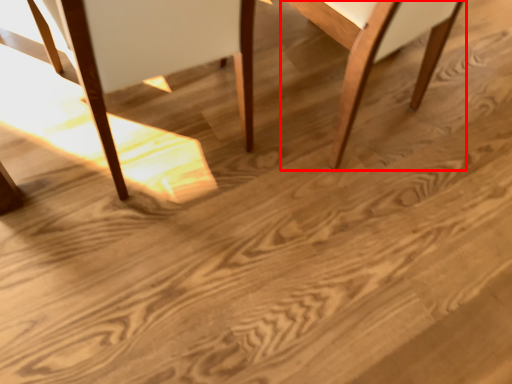
Question: From the image, what is the correct spatial relationship of chair (annotated by the red box) in relation to chair?

Choices:
 (A) left
 (B) right

Answer: (B)